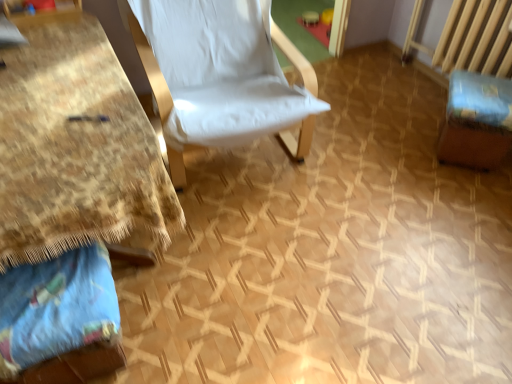
You are a GUI agent. You are given a task and a screenshot of the screen. Output one action in this format:
    pyautogui.click(x=<x>, y=<y>)
    Task: Click on the vacant space in between white fabric chair at center and brown fabric swivel chair at right
    The height and width of the screenshot is (384, 512).
    Given the screenshot: What is the action you would take?
    pyautogui.click(x=366, y=156)